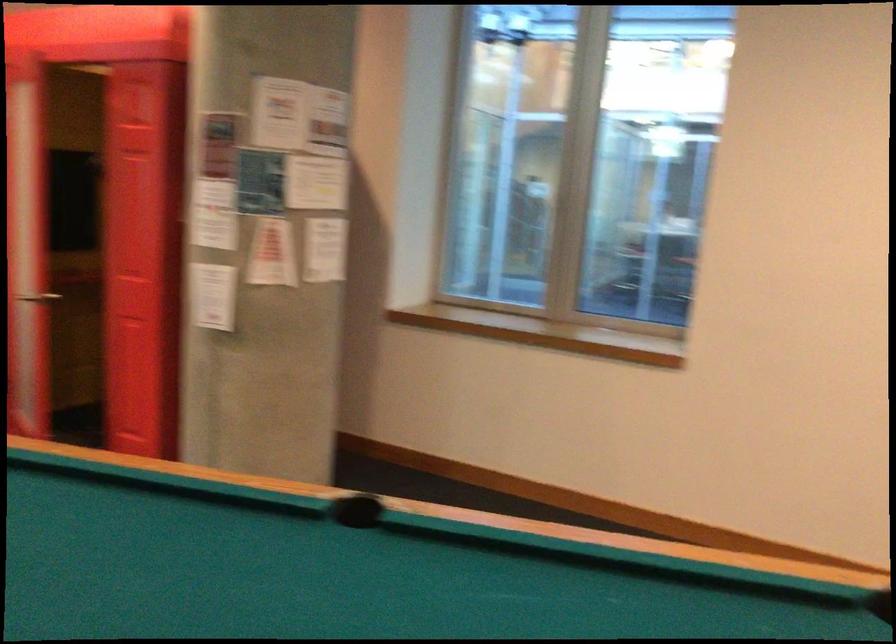
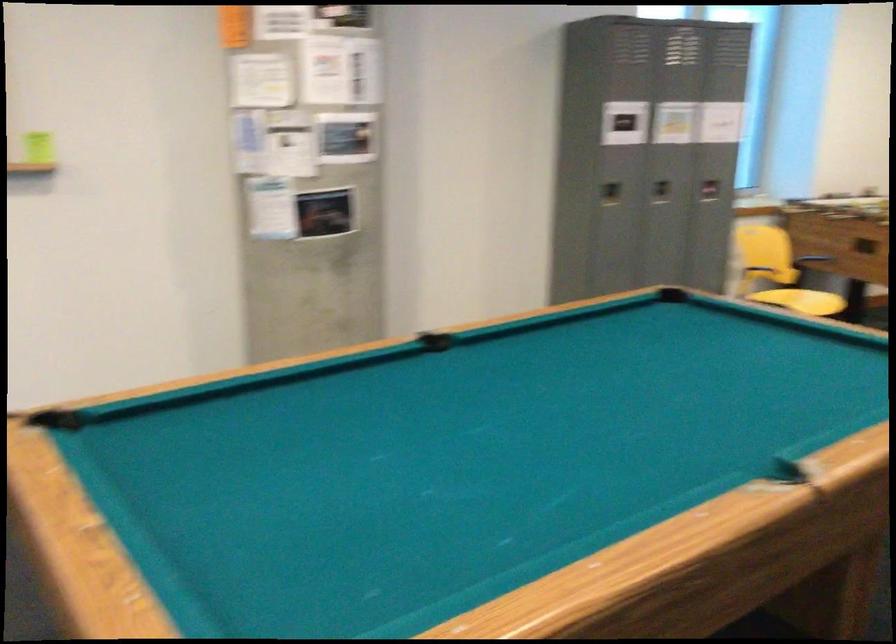
In the second image, find the point that corresponds to point 250,513 in the first image.

(788, 473)